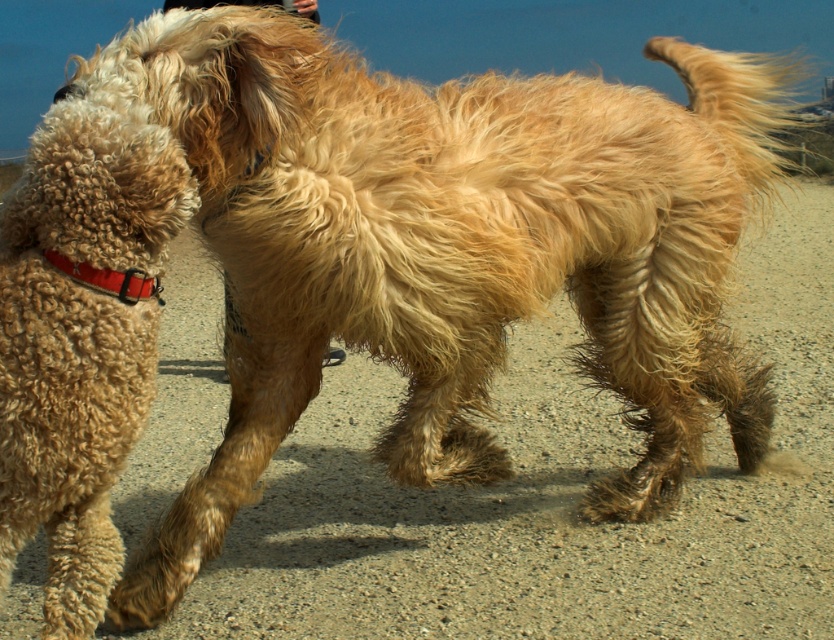
You are a dog owner who wants to put a new red fabric collar at left on your dog. The dog currently has a curly golden fur at left. Is the collar visible on the dog?

The curly golden fur at left is in front of the red fabric collar at left, so the collar is not visible on the dog.

You are a dog owner who wants to identify your dog in the image. Your dog has a red fabric collar at left. Where should you look relative to the curly golden fur at left?

The red fabric collar at left is to the right of the curly golden fur at left.